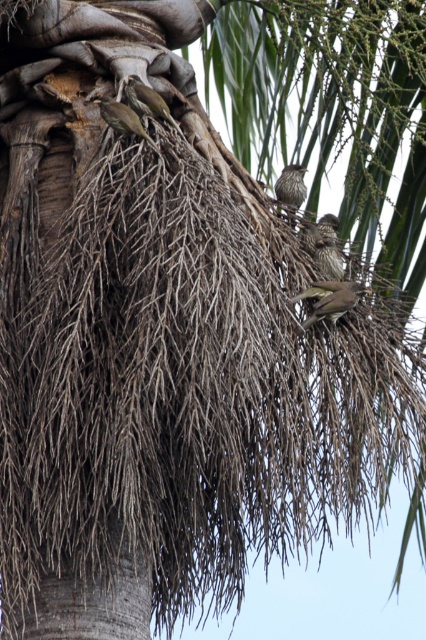
Question: Among these objects, which one is farthest from the camera?

Choices:
 (A) green textured bird at center
 (B) brown speckled feathers at center
 (C) brown speckled feathers at upper right

Answer: (B)

Question: Which object is the farthest from the brown speckled feathers at upper right?

Choices:
 (A) brown speckled feathers at upper left
 (B) speckled brown bird at upper left
 (C) brown speckled feathers at center

Answer: (A)

Question: Does green textured bird at center have a greater width compared to brown speckled feathers at center?

Choices:
 (A) yes
 (B) no

Answer: (A)

Question: Which object is positioned farthest from the brown speckled feathers at center?

Choices:
 (A) speckled brown bird at upper left
 (B) brown speckled feathers at upper left
 (C) green textured bird at center

Answer: (B)

Question: Does brown speckled feathers at upper left have a greater width compared to brown speckled feathers at center?

Choices:
 (A) yes
 (B) no

Answer: (A)

Question: Does brown speckled feathers at upper right have a greater width compared to brown speckled feathers at center?

Choices:
 (A) no
 (B) yes

Answer: (B)